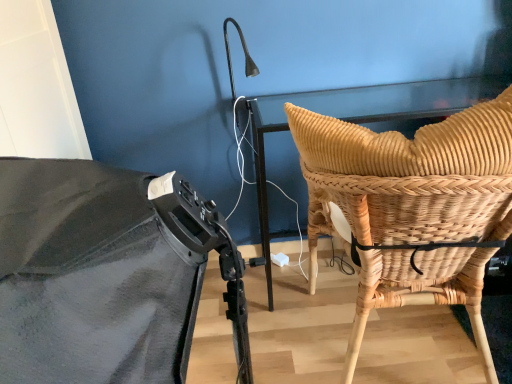
This screenshot has width=512, height=384. What do you see at coordinates (412, 206) in the screenshot? I see `woven natural wood chair back at right` at bounding box center [412, 206].

You are a GUI agent. You are given a task and a screenshot of the screen. Output one action in this format:
    pyautogui.click(x=<x>, y=<y>)
    Task: Click on the woven natural wood chair back at right
    The image size is (512, 384).
    Given the screenshot: What is the action you would take?
    pyautogui.click(x=412, y=206)

Find the location of `woven wood chair at right`. woven wood chair at right is located at coordinates (411, 208).

This screenshot has width=512, height=384. What do you see at coordinates (411, 208) in the screenshot?
I see `woven wood chair at right` at bounding box center [411, 208].

This screenshot has width=512, height=384. Find the location of `woven natural wood chair back at right`. woven natural wood chair back at right is located at coordinates (412, 206).

Which is more to the left, woven natural wood chair back at right or woven wood chair at right?

woven wood chair at right is more to the left.

Relative to woven wood chair at right, is woven natural wood chair back at right in front or behind?

Visually, woven natural wood chair back at right is located behind woven wood chair at right.

Is point (388, 267) positioned before point (349, 186)?

No, it is not.

From the image's perspective, who appears lower, woven natural wood chair back at right or woven wood chair at right?

From the image's view, woven wood chair at right is below.

Consider the image. From a real-world perspective, who is located lower, woven natural wood chair back at right or woven wood chair at right?

From a 3D spatial view, woven wood chair at right is below.

Does woven natural wood chair back at right have a lesser width compared to woven wood chair at right?

Correct, the width of woven natural wood chair back at right is less than that of woven wood chair at right.

Between woven natural wood chair back at right and woven wood chair at right, which one has more height?

Standing taller between the two is woven wood chair at right.

Which of these two, woven natural wood chair back at right or woven wood chair at right, is bigger?

woven wood chair at right is bigger.

Is woven wood chair at right inside woven natural wood chair back at right?

No, woven natural wood chair back at right does not contain woven wood chair at right.

Would you consider woven natural wood chair back at right to be distant from woven wood chair at right?

woven natural wood chair back at right is near woven wood chair at right, not far away.

Is woven natural wood chair back at right oriented towards woven wood chair at right?

Yes, woven natural wood chair back at right is aimed at woven wood chair at right.

Measure the distance from woven natural wood chair back at right to woven wood chair at right.

woven natural wood chair back at right and woven wood chair at right are 2.55 inches apart.

This screenshot has height=384, width=512. What are the coordinates of `basket that is above the woven wood chair at right (from a real-world perspective)` in the screenshot? It's located at (412, 206).

Considering the positions of objects woven wood chair at right and woven natural wood chair back at right in the image provided, who is more to the left, woven wood chair at right or woven natural wood chair back at right?

woven wood chair at right.

Is woven wood chair at right in front of or behind woven natural wood chair back at right in the image?

In the image, woven wood chair at right appears in front of woven natural wood chair back at right.

Is point (349, 216) behind point (370, 240)?

Yes, it is behind point (370, 240).

From the image's perspective, which one is positioned lower, woven wood chair at right or woven natural wood chair back at right?

woven wood chair at right.

From a real-world perspective, is woven wood chair at right on top of woven natural wood chair back at right?

No, from a real-world perspective, woven wood chair at right is not above woven natural wood chair back at right.

Consider the image. Considering the sizes of objects woven wood chair at right and woven natural wood chair back at right in the image provided, who is thinner, woven wood chair at right or woven natural wood chair back at right?

woven natural wood chair back at right is thinner.

Is woven wood chair at right shorter than woven natural wood chair back at right?

No.

Who is bigger, woven wood chair at right or woven natural wood chair back at right?

woven wood chair at right is bigger.

Choose the correct answer: Is woven wood chair at right inside woven natural wood chair back at right or outside it?

The correct answer is: outside.

Looking at this image, is woven wood chair at right far away from woven natural wood chair back at right?

No, there isn't a large distance between woven wood chair at right and woven natural wood chair back at right.

Is woven wood chair at right oriented away from woven natural wood chair back at right?

Yes, woven natural wood chair back at right is at the back of woven wood chair at right.

How many degrees apart are the facing directions of woven wood chair at right and woven natural wood chair back at right?

0.00019 degrees.

Locate an element on the screen. basket above the woven wood chair at right (from a real-world perspective) is located at coordinates (412, 206).

Identify the location of chair in front of the woven natural wood chair back at right. The image size is (512, 384). (411, 208).

I want to click on chair below the woven natural wood chair back at right (from the image's perspective), so click(411, 208).